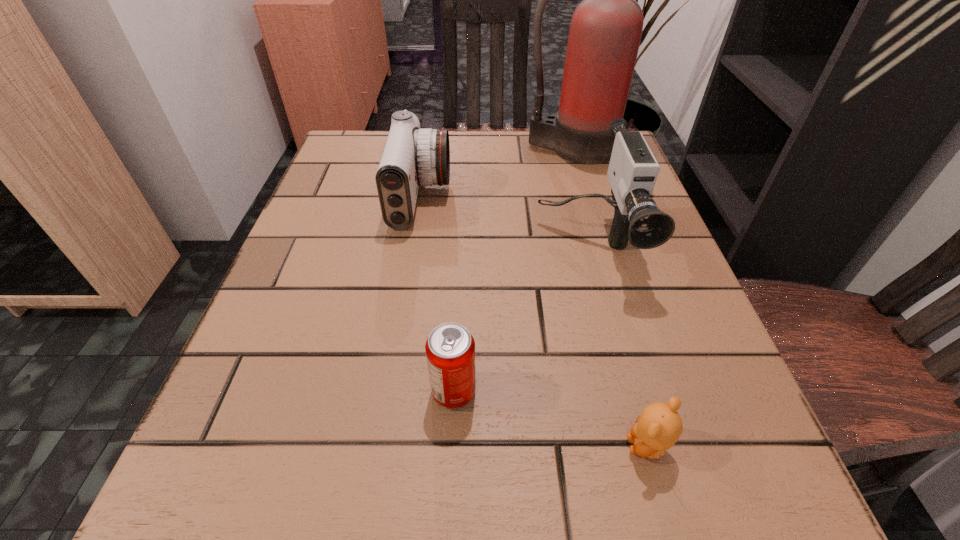
The image size is (960, 540). Identify the location of vacant space at the near left corner. (175, 505).

Locate an element on the screen. vacant space at the far right corner of the desktop is located at coordinates (578, 168).

The width and height of the screenshot is (960, 540). Find the location of `free space between the farthest object and the shortest object`. free space between the farthest object and the shortest object is located at coordinates (610, 297).

Where is `free spot between the tallest object and the shorter camcorder`? free spot between the tallest object and the shorter camcorder is located at coordinates (495, 173).

Where is `vacant space in between the third shortest object and the fourth tallest object`? vacant space in between the third shortest object and the fourth tallest object is located at coordinates (437, 294).

Image resolution: width=960 pixels, height=540 pixels. Find the location of `empty location between the shortest object and the third tallest object`. empty location between the shortest object and the third tallest object is located at coordinates (534, 322).

The width and height of the screenshot is (960, 540). What are the coordinates of `unoccupied position between the nearest object and the tallest object` in the screenshot? It's located at 610,297.

Where is `vacant space that's between the second shortest object and the shortest object`? The height and width of the screenshot is (540, 960). vacant space that's between the second shortest object and the shortest object is located at coordinates (550, 418).

You are a GUI agent. You are given a task and a screenshot of the screen. Output one action in this format:
    pyautogui.click(x=<x>, y=<y>)
    Task: Click on the vacant area between the third shortest object and the tallest object
    This screenshot has height=540, width=960.
    Given the screenshot: What is the action you would take?
    pyautogui.click(x=495, y=173)

At what (x,y) coordinates should I click in order to perform the action: click on vacant point located between the soda can and the shorter camcorder. Please return your answer as a coordinate pair (x, y). The image size is (960, 540). Looking at the image, I should click on coord(437,294).